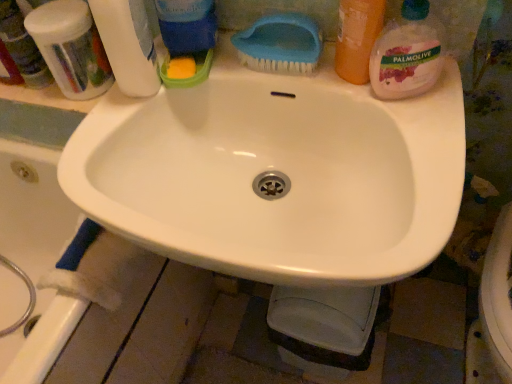
What is the approximate width of translucent plastic toothbrushes at upper left?

4.48 inches.

Describe the element at coordinates (357, 38) in the screenshot. The width and height of the screenshot is (512, 384). I see `translucent orange soap at upper right, which ranks as the 3th cleaning product in left-to-right order` at that location.

The image size is (512, 384). What are the coordinates of `white glossy sink at center` in the screenshot? It's located at (276, 174).

The height and width of the screenshot is (384, 512). What do you see at coordinates (276, 174) in the screenshot?
I see `white glossy sink at center` at bounding box center [276, 174].

Identify the location of translucent plastic toothbrushes at upper left. The width and height of the screenshot is (512, 384). (71, 48).

Is point (335, 56) closer or farther from the camera than point (50, 61)?

Point (335, 56) is closer to the camera than point (50, 61).

What's the angular difference between translucent orange soap at upper right, which ranks as the 3th cleaning product in left-to-right order, and translucent plastic toothbrushes at upper left's facing directions?

38 degrees.

Between translucent orange soap at upper right, placed as the second cleaning product when sorted from right to left, and translucent plastic toothbrushes at upper left, which one has smaller size?

Smaller between the two is translucent orange soap at upper right, placed as the second cleaning product when sorted from right to left.

From the image's perspective, is translucent orange soap at upper right, which ranks as the 3th cleaning product in left-to-right order, below translucent plastic toothbrushes at upper left?

Yes.

Which is nearer, (x=380, y=17) or (x=304, y=66)?

The point (x=380, y=17) is closer to the camera.

Does translucent orange soap at upper right, placed as the second cleaning product when sorted from right to left, lie behind blue plastic brush at upper center?

No, translucent orange soap at upper right, placed as the second cleaning product when sorted from right to left, is in front of blue plastic brush at upper center.

Measure the distance from translucent orange soap at upper right, which ranks as the 3th cleaning product in left-to-right order, to blue plastic brush at upper center.

They are 3.18 inches apart.

Looking at this image, between translucent orange soap at upper right, which ranks as the 3th cleaning product in left-to-right order, and blue plastic brush at upper center, which one has smaller size?

blue plastic brush at upper center.

Is blue matte sponge at upper left, which is the third cleaning product in right-to-left order, positioned with its back to palmolive liquid soap at upper right, which appears as the first cleaning product when viewed from the right?

That's not correct — blue matte sponge at upper left, which is the third cleaning product in right-to-left order, is not looking away from palmolive liquid soap at upper right, which appears as the first cleaning product when viewed from the right.

From the image's perspective, between blue matte sponge at upper left, the second cleaning product viewed from the left, and palmolive liquid soap at upper right, which appears as the first cleaning product when viewed from the right, which one is located above?

blue matte sponge at upper left, the second cleaning product viewed from the left, is shown above in the image.

Looking at their sizes, would you say blue matte sponge at upper left, the second cleaning product viewed from the left, is wider or thinner than palmolive liquid soap at upper right, the fourth cleaning product viewed from the left?

blue matte sponge at upper left, the second cleaning product viewed from the left, is wider than palmolive liquid soap at upper right, the fourth cleaning product viewed from the left.

Is blue matte sponge at upper left, which is the third cleaning product in right-to-left order, spatially inside palmolive liquid soap at upper right, the fourth cleaning product viewed from the left, or outside of it?

blue matte sponge at upper left, which is the third cleaning product in right-to-left order, is not inside palmolive liquid soap at upper right, the fourth cleaning product viewed from the left, it's outside.

Can you confirm if palmolive liquid soap at upper right, which appears as the first cleaning product when viewed from the right, is positioned to the left of blue plastic brush at upper center?

Incorrect, palmolive liquid soap at upper right, which appears as the first cleaning product when viewed from the right, is not on the left side of blue plastic brush at upper center.

Considering the relative sizes of palmolive liquid soap at upper right, the fourth cleaning product viewed from the left, and blue plastic brush at upper center in the image provided, is palmolive liquid soap at upper right, the fourth cleaning product viewed from the left, taller than blue plastic brush at upper center?

Yes, palmolive liquid soap at upper right, the fourth cleaning product viewed from the left, is taller than blue plastic brush at upper center.

From the image's perspective, who appears lower, palmolive liquid soap at upper right, which appears as the first cleaning product when viewed from the right, or blue plastic brush at upper center?

palmolive liquid soap at upper right, which appears as the first cleaning product when viewed from the right, from the image's perspective.

Which is behind, point (193, 26) or point (128, 95)?

The point (193, 26) is behind.

Measure the distance between blue matte sponge at upper left, the second cleaning product viewed from the left, and white plastic bottle at upper left, the 1th cleaning product from the left.

blue matte sponge at upper left, the second cleaning product viewed from the left, and white plastic bottle at upper left, the 1th cleaning product from the left, are 8.03 centimeters apart from each other.

From a real-world perspective, is blue matte sponge at upper left, which is the third cleaning product in right-to-left order, physically above white plastic bottle at upper left, the fourth cleaning product when ordered from right to left?

Indeed, from a real-world perspective, blue matte sponge at upper left, which is the third cleaning product in right-to-left order, stands above white plastic bottle at upper left, the fourth cleaning product when ordered from right to left.

Does blue matte sponge at upper left, which is the third cleaning product in right-to-left order, appear on the right side of white plastic bottle at upper left, the 1th cleaning product from the left?

Yes, blue matte sponge at upper left, which is the third cleaning product in right-to-left order, is to the right of white plastic bottle at upper left, the 1th cleaning product from the left.

Considering their positions, is palmolive liquid soap at upper right, which appears as the first cleaning product when viewed from the right, located in front of or behind white glossy sink at center?

Clearly, palmolive liquid soap at upper right, which appears as the first cleaning product when viewed from the right, is behind white glossy sink at center.

Does point (426, 30) lie in front of point (136, 110)?

Yes, it is in front of point (136, 110).

Can you tell me how much palmolive liquid soap at upper right, which appears as the first cleaning product when viewed from the right, and white glossy sink at center differ in facing direction?

The facing directions of palmolive liquid soap at upper right, which appears as the first cleaning product when viewed from the right, and white glossy sink at center are 25 degrees apart.

Considering the sizes of objects palmolive liquid soap at upper right, the fourth cleaning product viewed from the left, and white glossy sink at center in the image provided, who is taller, palmolive liquid soap at upper right, the fourth cleaning product viewed from the left, or white glossy sink at center?

white glossy sink at center is taller.

Which of these two, white plastic bottle at upper left, the 1th cleaning product from the left, or blue matte sponge at upper left, which is the third cleaning product in right-to-left order, is wider?

With larger width is blue matte sponge at upper left, which is the third cleaning product in right-to-left order.

Can you confirm if white plastic bottle at upper left, the fourth cleaning product when ordered from right to left, is shorter than blue matte sponge at upper left, which is the third cleaning product in right-to-left order?

Yes.

Consider the image. Is white plastic bottle at upper left, the fourth cleaning product when ordered from right to left, completely or partially outside of blue matte sponge at upper left, the second cleaning product viewed from the left?

That's correct, white plastic bottle at upper left, the fourth cleaning product when ordered from right to left, is outside of blue matte sponge at upper left, the second cleaning product viewed from the left.

Identify the location of cleaning product that is the 2nd one when counting forward from the translucent plastic toothbrushes at upper left. This screenshot has height=384, width=512. (357, 38).

Image resolution: width=512 pixels, height=384 pixels. I want to click on the 2nd cleaning product positioned above the blue plastic brush at upper center (from a real-world perspective), so 357,38.

Estimate the real-world distances between objects in this image. Which object is further from translucent plastic toothbrushes at upper left, white glossy sink at center or palmolive liquid soap at upper right, which appears as the first cleaning product when viewed from the right?

The object further to translucent plastic toothbrushes at upper left is palmolive liquid soap at upper right, which appears as the first cleaning product when viewed from the right.

Considering their positions, is blue plastic brush at upper center positioned further to white plastic bottle at upper left, the 1th cleaning product from the left, than translucent plastic toothbrushes at upper left?

blue plastic brush at upper center is positioned further to the anchor white plastic bottle at upper left, the 1th cleaning product from the left.

Estimate the real-world distances between objects in this image. Which object is closer to palmolive liquid soap at upper right, which appears as the first cleaning product when viewed from the right, translucent orange soap at upper right, which ranks as the 3th cleaning product in left-to-right order, or blue matte sponge at upper left, which is the third cleaning product in right-to-left order?

translucent orange soap at upper right, which ranks as the 3th cleaning product in left-to-right order, is positioned closer to the anchor palmolive liquid soap at upper right, which appears as the first cleaning product when viewed from the right.

From the image, which object appears to be nearer to translucent orange soap at upper right, which ranks as the 3th cleaning product in left-to-right order, blue matte sponge at upper left, the second cleaning product viewed from the left, or blue plastic brush at upper center?

blue plastic brush at upper center lies closer to translucent orange soap at upper right, which ranks as the 3th cleaning product in left-to-right order, than the other object.

From the image, which object appears to be farther from translucent orange soap at upper right, which ranks as the 3th cleaning product in left-to-right order, blue plastic brush at upper center or white plastic bottle at upper left, the 1th cleaning product from the left?

The object further to translucent orange soap at upper right, which ranks as the 3th cleaning product in left-to-right order, is white plastic bottle at upper left, the 1th cleaning product from the left.

Considering their positions, is white glossy sink at center positioned closer to white plastic bottle at upper left, the 1th cleaning product from the left, than translucent plastic toothbrushes at upper left?

translucent plastic toothbrushes at upper left.

Which object lies nearer to the anchor point translucent plastic toothbrushes at upper left, palmolive liquid soap at upper right, the fourth cleaning product viewed from the left, or translucent orange soap at upper right, placed as the second cleaning product when sorted from right to left?

translucent orange soap at upper right, placed as the second cleaning product when sorted from right to left, lies closer to translucent plastic toothbrushes at upper left than the other object.

Considering their positions, is blue plastic brush at upper center positioned closer to translucent plastic toothbrushes at upper left than white glossy sink at center?

The object closer to translucent plastic toothbrushes at upper left is blue plastic brush at upper center.

Locate an element on the screen. brush situated between white plastic bottle at upper left, the 1th cleaning product from the left, and palmolive liquid soap at upper right, the fourth cleaning product viewed from the left, from left to right is located at coordinates (280, 44).

Where is `brush situated between translucent plastic toothbrushes at upper left and translucent orange soap at upper right, which ranks as the 3th cleaning product in left-to-right order, from left to right`? Image resolution: width=512 pixels, height=384 pixels. brush situated between translucent plastic toothbrushes at upper left and translucent orange soap at upper right, which ranks as the 3th cleaning product in left-to-right order, from left to right is located at coordinates pyautogui.click(x=280, y=44).

Find the location of a particular element. This screenshot has height=384, width=512. sink located between blue matte sponge at upper left, the second cleaning product viewed from the left, and palmolive liquid soap at upper right, the fourth cleaning product viewed from the left, in the left-right direction is located at coordinates (276, 174).

The image size is (512, 384). I want to click on cleaning product between blue plastic brush at upper center and white glossy sink at center in the up-down direction, so 408,53.